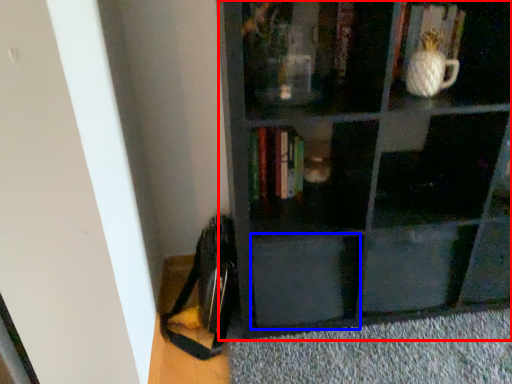
Question: Which object appears closest to the camera in this image, shelf (highlighted by a red box) or drawer (highlighted by a blue box)?

Choices:
 (A) shelf
 (B) drawer

Answer: (A)